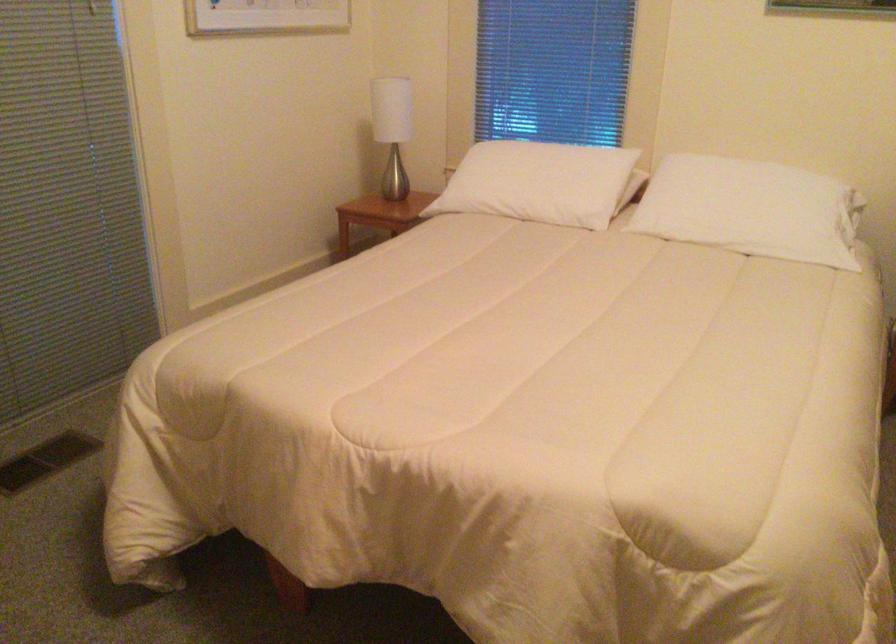
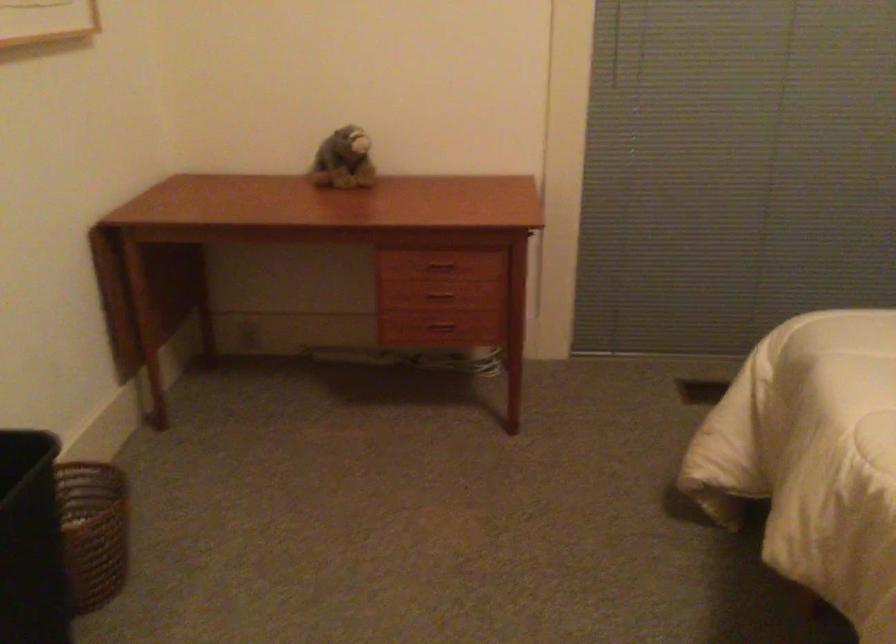
Question: The images are taken continuously from a first-person perspective. In which direction is your viewpoint rotating?

Choices:
 (A) Left
 (B) Right
 (C) Up
 (D) Down

Answer: (A)